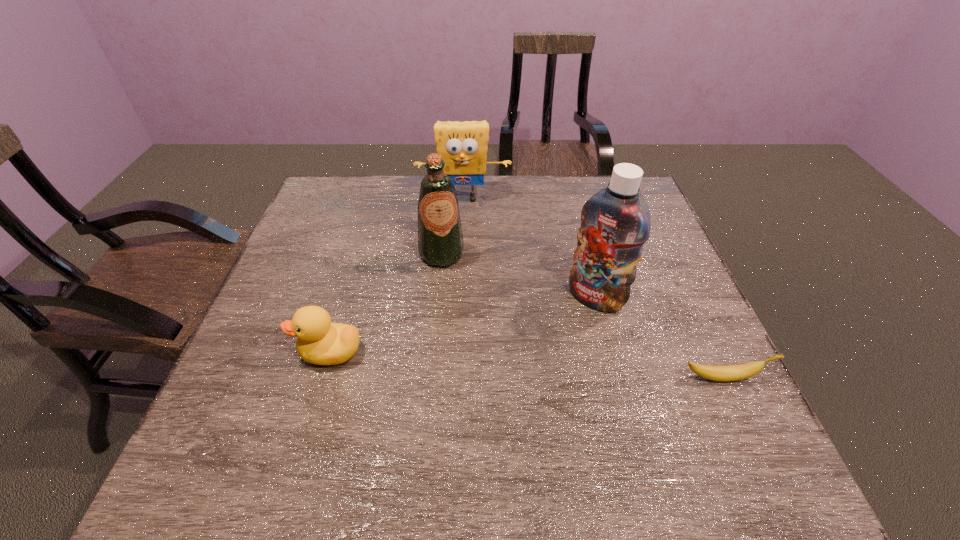
At what (x,y) coordinates should I click in order to perform the action: click on object that is at the left edge. Please return your answer as a coordinate pair (x, y). This screenshot has width=960, height=540. Looking at the image, I should click on (321, 342).

You are a GUI agent. You are given a task and a screenshot of the screen. Output one action in this format:
    pyautogui.click(x=<x>, y=<y>)
    Task: Click on the object at the right edge
    
    Given the screenshot: What is the action you would take?
    pyautogui.click(x=735, y=372)

Locate an element on the screen. The width and height of the screenshot is (960, 540). free region at the far edge is located at coordinates (549, 177).

You are a GUI agent. You are given a task and a screenshot of the screen. Output one action in this format:
    pyautogui.click(x=<x>, y=<y>)
    Task: Click on the free space at the near edge
    The image size is (960, 540).
    Given the screenshot: What is the action you would take?
    pyautogui.click(x=421, y=417)

In order to click on vacant space at the left edge in this screenshot , I will do `click(343, 241)`.

Identify the location of free space at the right edge of the desktop. (653, 378).

Locate an element on the screen. This screenshot has width=960, height=540. vacant area at the far left corner is located at coordinates (307, 217).

Identify the location of vacant area that lies between the second nearest object and the shortest object. (526, 364).

Find the location of a particular element. The height and width of the screenshot is (540, 960). empty space that is in between the duck and the fourth nearest object is located at coordinates (386, 303).

The image size is (960, 540). I want to click on vacant space in between the duck and the second object from right to left, so click(463, 325).